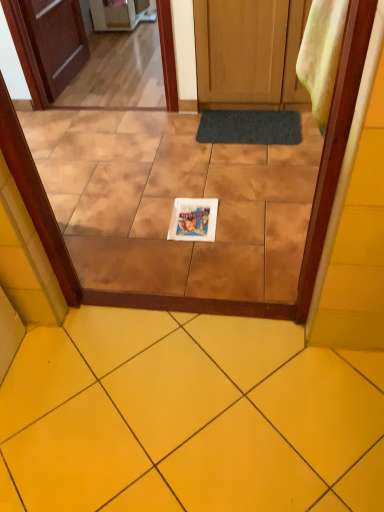
Find the location of `white glossy magazine at center`. white glossy magazine at center is located at coordinates (193, 220).

At what (x,y) coordinates should I click in order to perform the action: click on dark gray textured mat at center. Please return your answer as a coordinate pair (x, y). The width and height of the screenshot is (384, 512). Looking at the image, I should click on (250, 127).

From the image's perspective, between white glossy magazine at center and dark gray textured mat at center, which one is located above?

From the image's view, dark gray textured mat at center is above.

How far apart are white glossy magazine at center and dark gray textured mat at center?

white glossy magazine at center is 72.11 centimeters from dark gray textured mat at center.

Considering the relative sizes of white glossy magazine at center and dark gray textured mat at center in the image provided, is white glossy magazine at center taller than dark gray textured mat at center?

No.

Is the surface of white glossy magazine at center in direct contact with dark gray textured mat at center?

No, white glossy magazine at center is not next to dark gray textured mat at center.

Considering the relative positions of white glossy magazine at center and yellow ceramic tile at center in the image provided, is white glossy magazine at center behind yellow ceramic tile at center?

That is True.

Based on the photo, is white glossy magazine at center positioned beyond the bounds of yellow ceramic tile at center?

Yes, white glossy magazine at center is not within yellow ceramic tile at center.

In terms of size, does white glossy magazine at center appear bigger or smaller than yellow ceramic tile at center?

Clearly, white glossy magazine at center is smaller in size than yellow ceramic tile at center.

The image size is (384, 512). In order to click on doormat on the right of white glossy magazine at center in this screenshot , I will do `click(250, 127)`.

From a real-world perspective, between dark gray textured mat at center and white glossy magazine at center, who is vertically lower?

In real-world perspective, white glossy magazine at center is lower.

Which object is further away from the camera, dark gray textured mat at center or white glossy magazine at center?

dark gray textured mat at center is more distant.

Which object is thinner, dark gray textured mat at center or white glossy magazine at center?

white glossy magazine at center is thinner.

Does dark gray textured mat at center have a smaller size compared to yellow ceramic tile at center?

Yes.

Between point (265, 122) and point (274, 377), which one is positioned behind?

The point (265, 122) is behind.

Considering the sizes of objects dark gray textured mat at center and yellow ceramic tile at center in the image provided, who is wider, dark gray textured mat at center or yellow ceramic tile at center?

Wider between the two is yellow ceramic tile at center.

Who is taller, dark gray textured mat at center or yellow ceramic tile at center?

With more height is yellow ceramic tile at center.

Is yellow ceramic tile at center turned away from white glossy magazine at center?

No, white glossy magazine at center is not at the back of yellow ceramic tile at center.

Who is bigger, yellow ceramic tile at center or white glossy magazine at center?

yellow ceramic tile at center.

From the image's perspective, is yellow ceramic tile at center over white glossy magazine at center?

No, from the image's perspective, yellow ceramic tile at center is not over white glossy magazine at center.

Is yellow ceramic tile at center positioned beyond the bounds of dark gray textured mat at center?

Yes.

Is yellow ceramic tile at center wider or thinner than dark gray textured mat at center?

Clearly, yellow ceramic tile at center has more width compared to dark gray textured mat at center.

At what (x,y) coordinates should I click in order to perform the action: click on doormat above the yellow ceramic tile at center (from the image's perspective). Please return your answer as a coordinate pair (x, y). Looking at the image, I should click on (250, 127).

Considering the relative sizes of yellow ceramic tile at center and dark gray textured mat at center in the image provided, is yellow ceramic tile at center shorter than dark gray textured mat at center?

In fact, yellow ceramic tile at center may be taller than dark gray textured mat at center.

You are a GUI agent. You are given a task and a screenshot of the screen. Output one action in this format:
    pyautogui.click(x=<x>, y=<y>)
    Task: Click on the doormat that is above the white glossy magazine at center (from the image's perspective)
    
    Given the screenshot: What is the action you would take?
    pyautogui.click(x=250, y=127)

Locate an element on the screen. The image size is (384, 512). magazine that is on the right side of yellow ceramic tile at center is located at coordinates (193, 220).

Consider the image. From the image, which object appears to be farther from dark gray textured mat at center, yellow ceramic tile at center or white glossy magazine at center?

Among the two, yellow ceramic tile at center is located further to dark gray textured mat at center.

Looking at the image, which one is located closer to white glossy magazine at center, yellow ceramic tile at center or dark gray textured mat at center?

The object closer to white glossy magazine at center is dark gray textured mat at center.

Considering their positions, is dark gray textured mat at center positioned closer to yellow ceramic tile at center than white glossy magazine at center?

white glossy magazine at center.

Looking at the image, which one is located further to dark gray textured mat at center, white glossy magazine at center or yellow ceramic tile at center?

Based on the image, yellow ceramic tile at center appears to be further to dark gray textured mat at center.

Estimate the real-world distances between objects in this image. Which object is closer to yellow ceramic tile at center, white glossy magazine at center or dark gray textured mat at center?

white glossy magazine at center lies closer to yellow ceramic tile at center than the other object.

Which object lies further to the anchor point white glossy magazine at center, dark gray textured mat at center or yellow ceramic tile at center?

The object further to white glossy magazine at center is yellow ceramic tile at center.

Identify the location of magazine positioned between yellow ceramic tile at center and dark gray textured mat at center from near to far. The width and height of the screenshot is (384, 512). (193, 220).